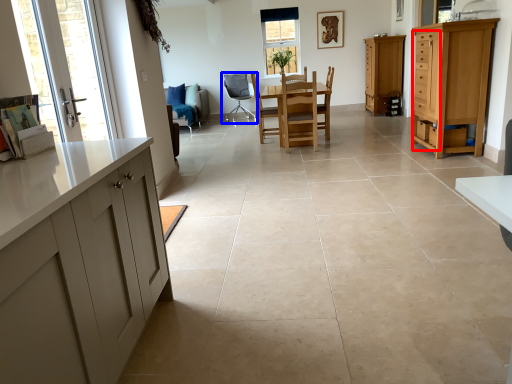
Question: Which point is further to the camera, drawer (highlighted by a red box) or chair (highlighted by a blue box)?

Choices:
 (A) drawer
 (B) chair

Answer: (B)